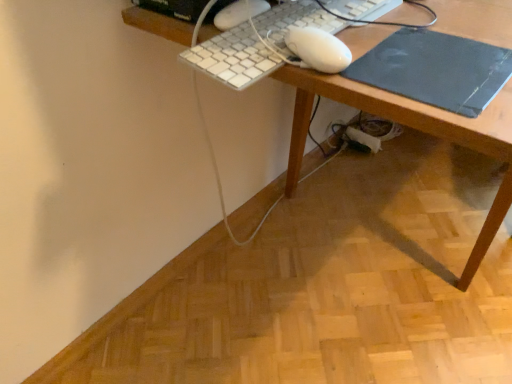
Describe the element at coordinates (435, 69) in the screenshot. I see `black matte mousepad at right` at that location.

Measure the distance between point (x=361, y=74) and camera.

The depth of point (x=361, y=74) is 21.61 inches.

Locate an element on the screen. Image resolution: width=512 pixels, height=384 pixels. white plastic keyboard at upper center is located at coordinates (233, 57).

Can you confirm if black matte mousepad at right is thinner than white plastic keyboard at upper center?

Correct, the width of black matte mousepad at right is less than that of white plastic keyboard at upper center.

Does point (435, 103) lie in front of point (240, 65)?

Yes.

From a real-world perspective, is black matte mousepad at right positioned above or below white plastic keyboard at upper center?

black matte mousepad at right is below white plastic keyboard at upper center.

In the image, there is a white plastic keyboard at upper center. Where is `mousepad below it (from the image's perspective)`? The image size is (512, 384). mousepad below it (from the image's perspective) is located at coordinates (435, 69).

Can you confirm if white plastic keyboard at upper center is shorter than wooden desk at center?

Yes.

Is wooden desk at center at the back of white plastic keyboard at upper center?

white plastic keyboard at upper center is not turned away from wooden desk at center.

Is white plastic keyboard at upper center completely or partially outside of wooden desk at center?

Absolutely, white plastic keyboard at upper center is external to wooden desk at center.

Is white plastic keyboard at upper center thinner than wooden desk at center?

Yes, white plastic keyboard at upper center is thinner than wooden desk at center.

Considering the relative sizes of wooden desk at center and black matte mousepad at right in the image provided, is wooden desk at center shorter than black matte mousepad at right?

In fact, wooden desk at center may be taller than black matte mousepad at right.

Between wooden desk at center and black matte mousepad at right, which one has larger width?

Wider between the two is wooden desk at center.

From the image's perspective, would you say wooden desk at center is shown under black matte mousepad at right?

No, from the image's perspective, wooden desk at center is not beneath black matte mousepad at right.

Can black matte mousepad at right be found inside wooden desk at center?

Yes, black matte mousepad at right can be found within wooden desk at center.

Is point (449, 16) positioned before point (220, 56)?

That is False.

Does wooden desk at center appear on the right side of white plastic keyboard at upper center?

Yes, wooden desk at center is to the right of white plastic keyboard at upper center.

Is wooden desk at center not within white plastic keyboard at upper center?

Absolutely, wooden desk at center is external to white plastic keyboard at upper center.

Is wooden desk at center further to camera compared to white plastic keyboard at upper center?

No, it is not.

Looking at this image, how distant is black matte mousepad at right from wooden desk at center?

black matte mousepad at right and wooden desk at center are 2.70 inches apart from each other.

Which object is closer to the camera taking this photo, black matte mousepad at right or wooden desk at center?

wooden desk at center is in front.

Can you confirm if black matte mousepad at right is shorter than wooden desk at center?

Yes.

Identify the location of mousepad on the left of wooden desk at center. This screenshot has height=384, width=512. (435, 69).

Looking at this image, would you say white plastic keyboard at upper center is inside or outside black matte mousepad at right?

white plastic keyboard at upper center is not inside black matte mousepad at right, it's outside.

Locate an element on the screen. computer keyboard behind the black matte mousepad at right is located at coordinates (233, 57).

Is point (256, 67) closer to viewer compared to point (486, 76)?

No, (256, 67) is behind (486, 76).

From the image's perspective, which is above, white plastic keyboard at upper center or black matte mousepad at right?

white plastic keyboard at upper center is shown above in the image.

The image size is (512, 384). I want to click on computer keyboard behind the black matte mousepad at right, so click(x=233, y=57).

At what (x,y) coordinates should I click in order to perform the action: click on desk beneath the white plastic keyboard at upper center (from a real-world perspective). Please return your answer as a coordinate pair (x, y). Looking at the image, I should click on (411, 127).

From the picture: When comparing their distances from white plastic keyboard at upper center, does wooden desk at center or black matte mousepad at right seem further?

black matte mousepad at right is positioned further to the anchor white plastic keyboard at upper center.

Looking at the image, which one is located closer to wooden desk at center, white plastic keyboard at upper center or black matte mousepad at right?

black matte mousepad at right is positioned closer to the anchor wooden desk at center.

Estimate the real-world distances between objects in this image. Which object is further from white plastic keyboard at upper center, black matte mousepad at right or wooden desk at center?

The object further to white plastic keyboard at upper center is black matte mousepad at right.

In the scene shown: Considering their positions, is wooden desk at center positioned closer to black matte mousepad at right than white plastic keyboard at upper center?

The object closer to black matte mousepad at right is wooden desk at center.

From the image, which object appears to be farther from wooden desk at center, black matte mousepad at right or white plastic keyboard at upper center?

Based on the image, white plastic keyboard at upper center appears to be further to wooden desk at center.

In the scene shown: Looking at the image, which one is located further to black matte mousepad at right, white plastic keyboard at upper center or wooden desk at center?

white plastic keyboard at upper center.

Locate an element on the screen. This screenshot has width=512, height=384. mousepad between white plastic keyboard at upper center and wooden desk at center is located at coordinates (435, 69).